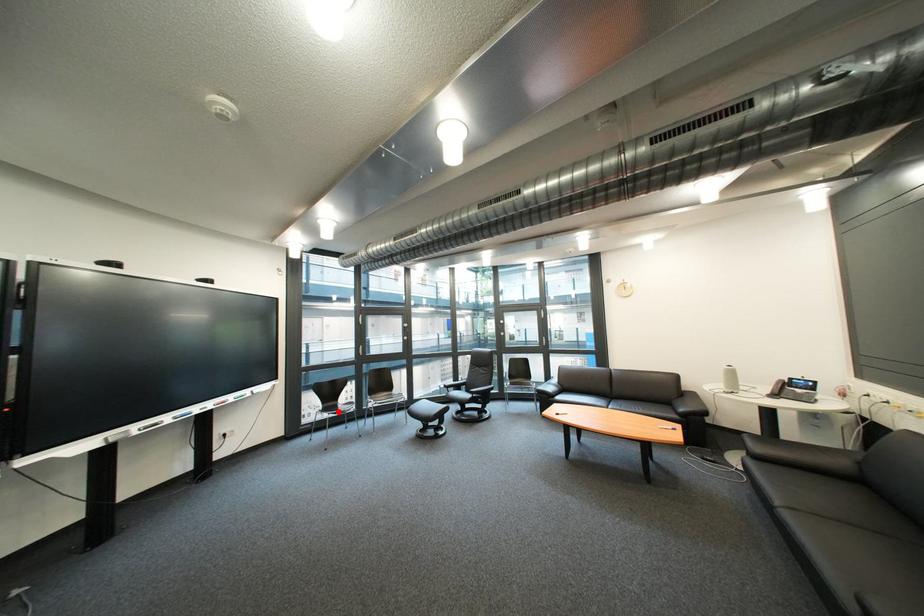
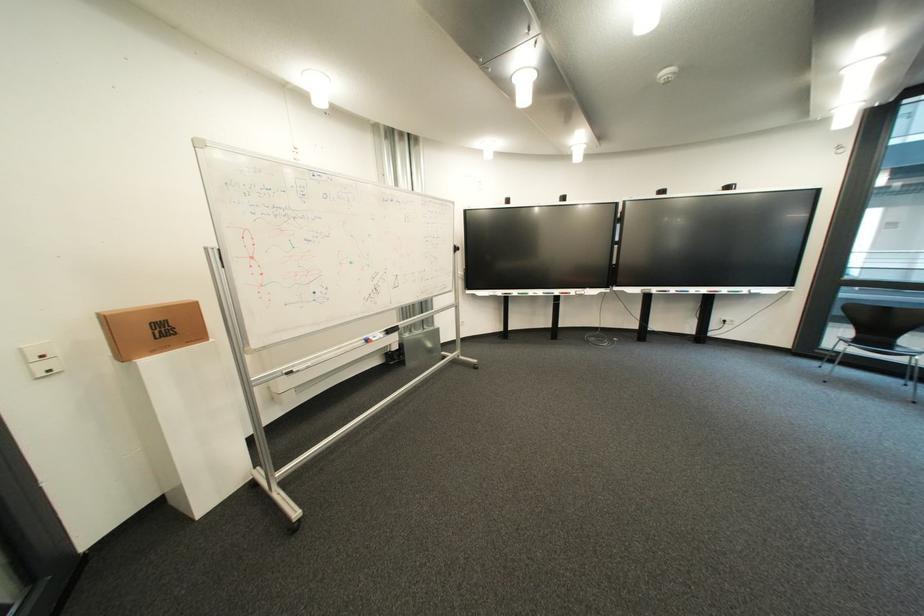
Question: I am providing you with two images of the same scene from different viewpoints. Image1 has a red point marked. In image2, the corresponding 3D location appears at what relative position? Reply with the corresponding letter.

Choices:
 (A) Closer
 (B) Farther

Answer: (A)